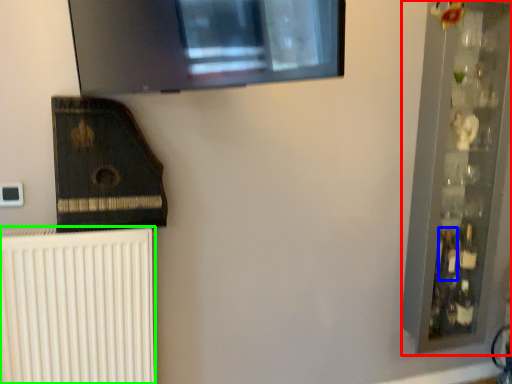
Question: Which object is positioned farthest from shelf (highlighted by a red box)? Select from bottle (highlighted by a blue box) and radiator (highlighted by a green box).

Choices:
 (A) bottle
 (B) radiator

Answer: (B)